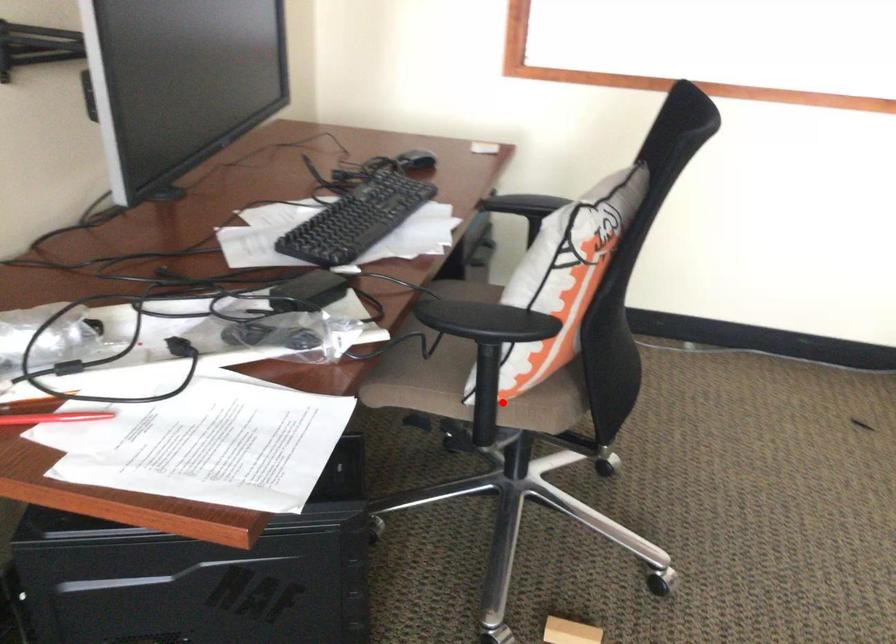
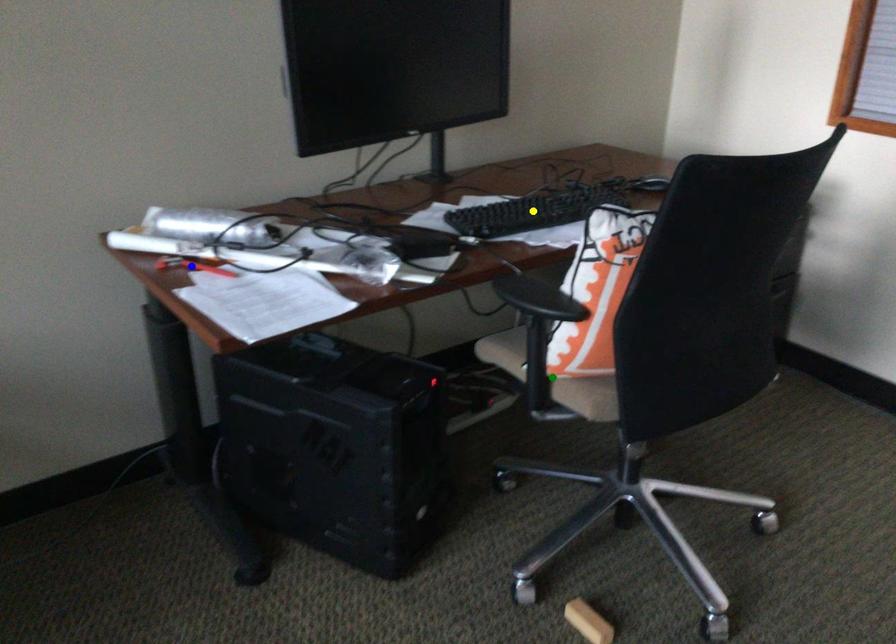
Question: I am providing you with two images of the same scene from different viewpoints. A red point is marked on the first image. You are given multiple points on the second image. Which point in image 2 represents the same 3d spot as the red point in image 1?

Choices:
 (A) yellow point
 (B) blue point
 (C) green point

Answer: (C)